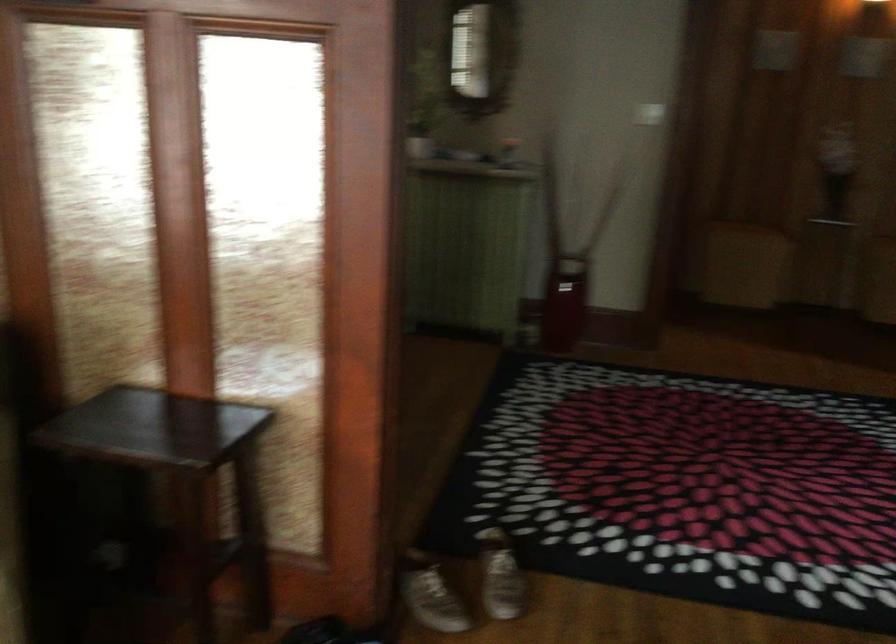
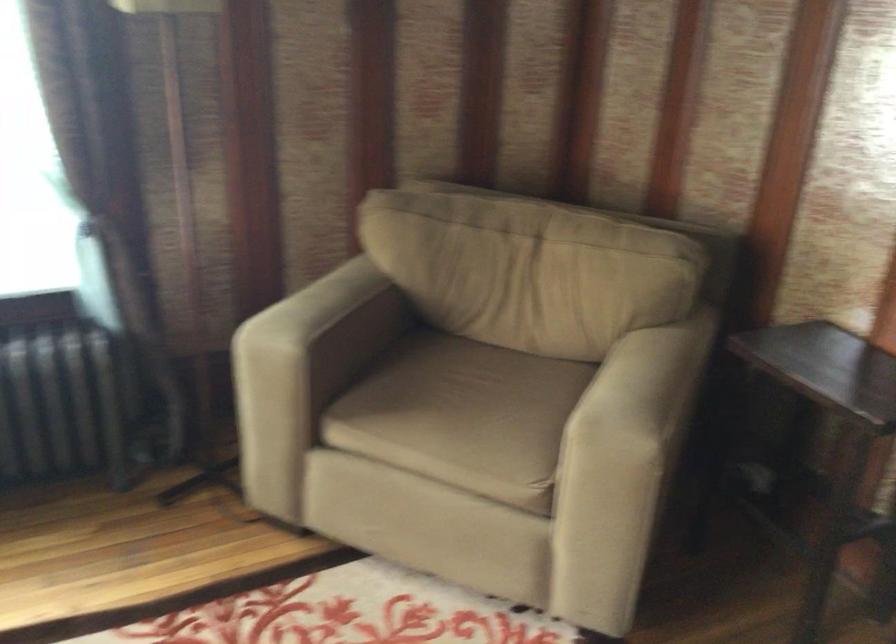
Question: The first image is from the beginning of the video and the second image is from the end. How did the camera likely rotate when shooting the video?

Choices:
 (A) Left
 (B) Right
 (C) Up
 (D) Down

Answer: (A)